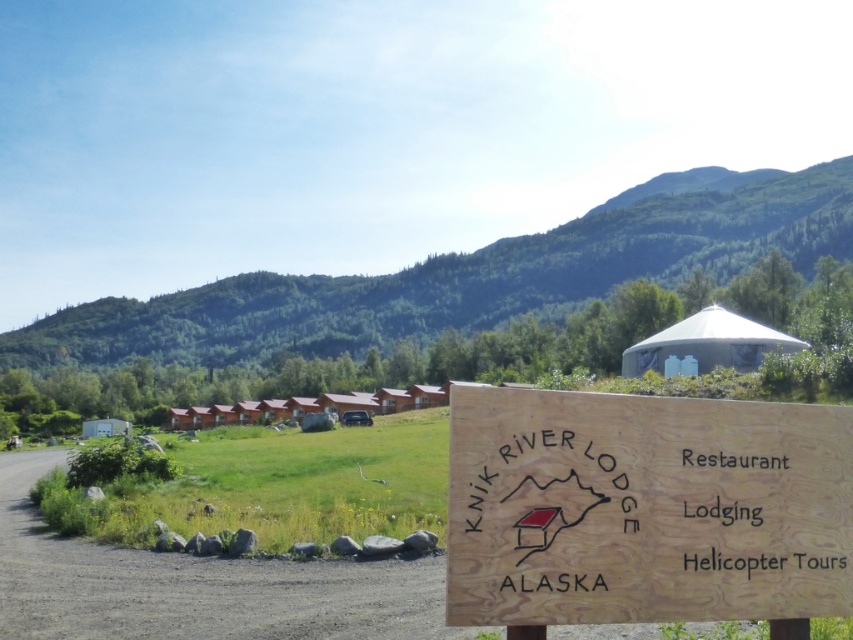
Looking at the scene, which object is positioned to the right of the other? The wooden sign at center or the green forested mountain at upper center?

The wooden sign at center is positioned to the right of the green forested mountain at upper center.

You are a guest at the lodge and want to see the green forested mountain at upper center. From your current position in front of the wooden sign at center, which direction should you look to see the mountain?

The green forested mountain at upper center is located above the wooden sign at center, so you should look upward to see it.